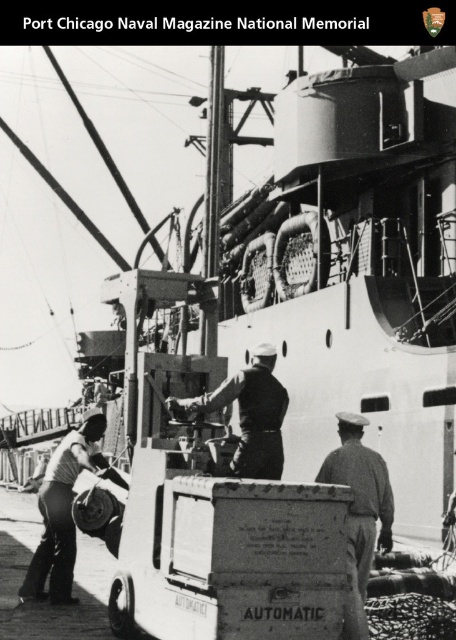
Is point (342, 420) positioned in front of point (206, 406)?

No.

Between point (357, 440) and point (243, 442), which one is positioned in front?

Point (243, 442)

Describe the element at coordinates (359, 512) in the screenshot. I see `light brown uniform at center` at that location.

The width and height of the screenshot is (456, 640). Identify the location of light brown uniform at center. (359, 512).

In the scene shown: Can you confirm if light brown uniform at center is positioned to the left of light gray uniform at lower left?

No, light brown uniform at center is not to the left of light gray uniform at lower left.

Does light brown uniform at center have a greater height compared to light gray uniform at lower left?

In fact, light brown uniform at center may be shorter than light gray uniform at lower left.

Who is more distant from viewer, (x=371, y=556) or (x=91, y=422)?

Point (x=91, y=422)

You are a GUI agent. You are given a task and a screenshot of the screen. Output one action in this format:
    pyautogui.click(x=<x>, y=<y>)
    Task: Click on the light brown uniform at center
    This screenshot has height=640, width=456.
    Given the screenshot: What is the action you would take?
    pyautogui.click(x=359, y=512)

Does light gray uniform at lower left appear on the left side of dark gray uniform at center?

Indeed, light gray uniform at lower left is positioned on the left side of dark gray uniform at center.

Can you confirm if light gray uniform at lower left is bigger than dark gray uniform at center?

Indeed, light gray uniform at lower left has a larger size compared to dark gray uniform at center.

Between point (72, 522) and point (210, 396), which one is positioned behind?

The point (72, 522) is behind.

This screenshot has width=456, height=640. I want to click on light gray uniform at lower left, so click(62, 512).